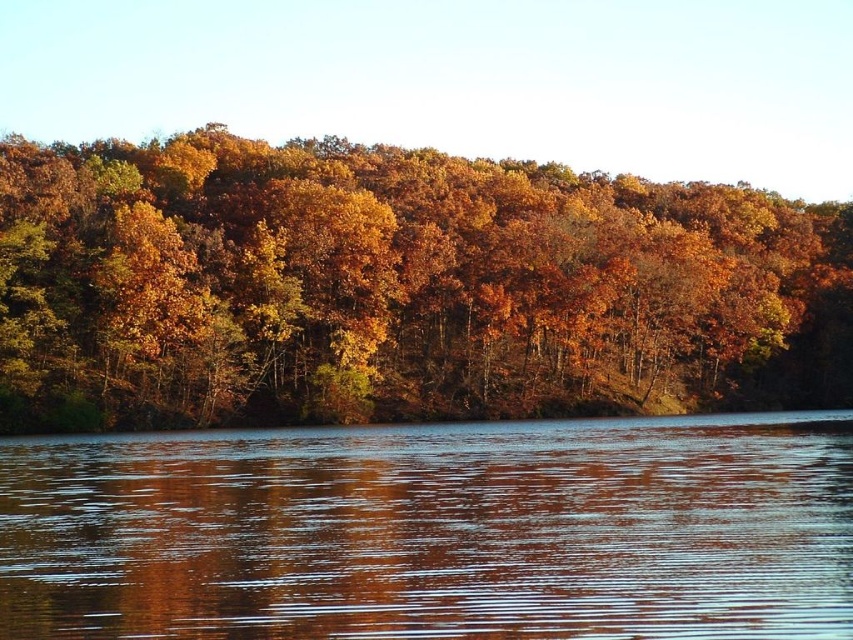
You are standing at the edge of the forest and want to walk towards the autumn leaves at center and the glossy reflective water at center. Which object will you encounter first?

You will encounter the autumn leaves at center first because it is closer to you than the glossy reflective water at center, which is further away.

In the scene shown: You are standing at the edge of the forest and see the autumn leaves at center and the glossy reflective water at center. Which object is bigger in the image?

The autumn leaves at center has a larger size compared to the glossy reflective water at center, so the autumn leaves at center is bigger.

You are standing at the center of the forest and see the point labeled as point (398, 288). What is located at that point?

The point (398, 288) corresponds to autumn leaves at center.